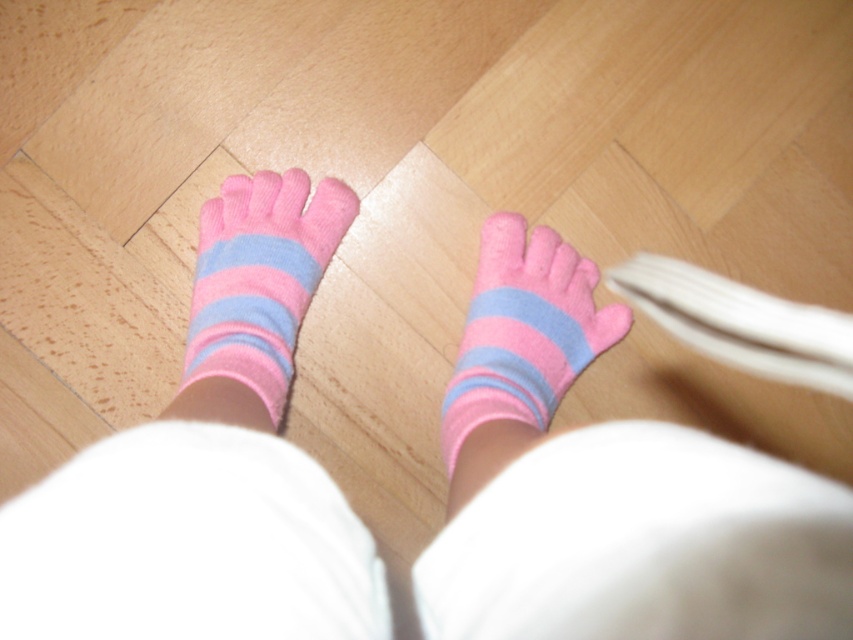
Question: Does pink fuzzy socks at left have a lesser width compared to pink fuzzy socks at center?

Choices:
 (A) yes
 (B) no

Answer: (A)

Question: Is pink soft socks at center below pink fuzzy socks at left?

Choices:
 (A) yes
 (B) no

Answer: (A)

Question: Which point appears closest to the camera in this image?

Choices:
 (A) (457, 627)
 (B) (239, 332)
 (C) (532, 401)

Answer: (A)

Question: Is pink soft socks at center to the left of pink fuzzy socks at center from the viewer's perspective?

Choices:
 (A) no
 (B) yes

Answer: (B)

Question: Which object appears closest to the camera in this image?

Choices:
 (A) pink fuzzy socks at left
 (B) pink soft socks at center

Answer: (B)

Question: Which object is the farthest from the pink fuzzy socks at left?

Choices:
 (A) pink fuzzy socks at center
 (B) pink soft socks at center

Answer: (A)